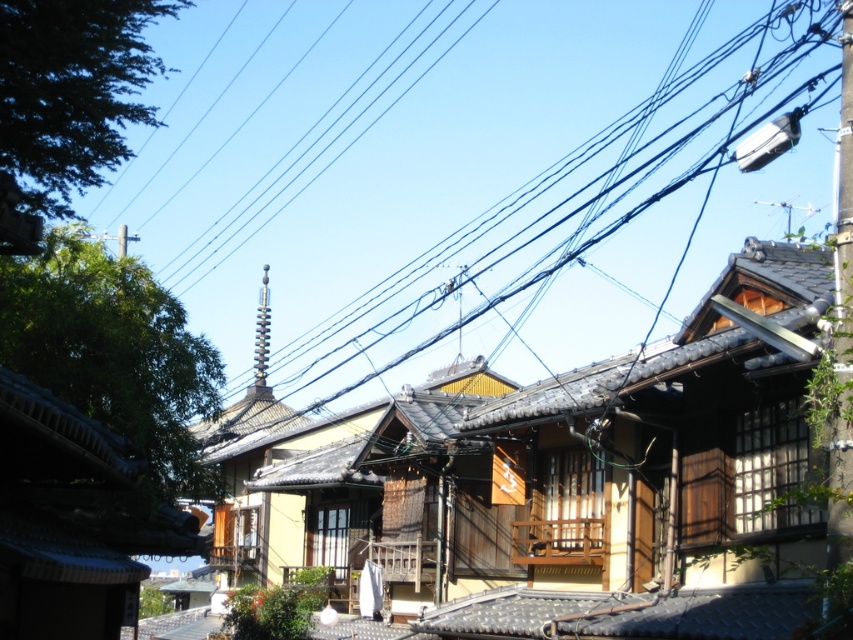
You are a drone operator trying to navigate a small drone through the streets of this traditional Japanese neighborhood. The drone has a height limit of 0.7 meters. Given the position of the black wire at upper center at coordinates point 0.338, 0.676, can the drone safely pass under it without hitting the wire?

The black wire at upper center is located at point (576, 216). Since the drone has a height limit of 0.7 meters, and the wire is at 0.676 in the vertical axis, the drone cannot safely pass under it as the wire is lower than the drone can fly without exceeding its height limit.

You are an electrician assessing the street scene. You notice the black wire at upper center and the metallic pole at upper right. Which object has a greater width?

The black wire at upper center has a greater width than the metallic pole at upper right.